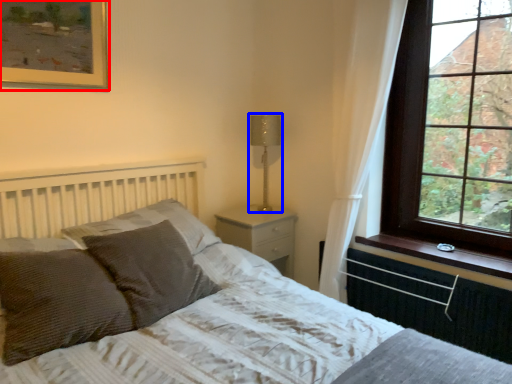
Question: Which of the following is the farthest to the observer, picture frame (highlighted by a red box) or table lamp (highlighted by a blue box)?

Choices:
 (A) picture frame
 (B) table lamp

Answer: (B)